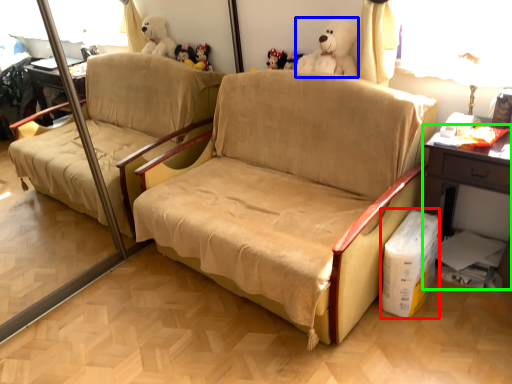
Question: Which object is the closest to the cardboard box (highlighted by a red box)? Choose among these: toy (highlighted by a blue box) or table (highlighted by a green box).

Choices:
 (A) toy
 (B) table

Answer: (B)